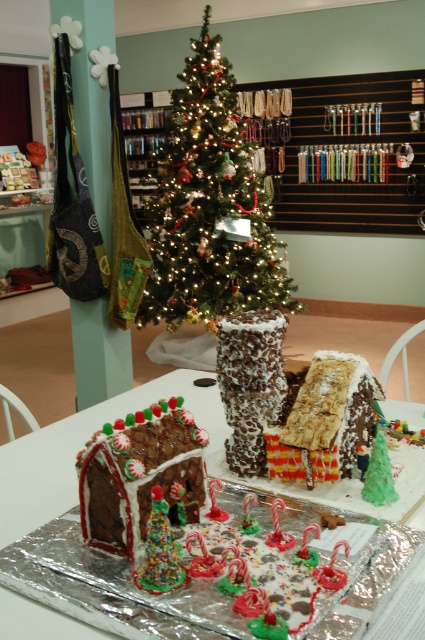
Does chocolate cake at center appear under chocolate-frosted gingerbread house at center?

Correct, chocolate cake at center is located below chocolate-frosted gingerbread house at center.

Does point (214, 451) come behind point (261, 365)?

Yes, point (214, 451) is farther from viewer.

Identify the location of chocolate cake at center. The image size is (425, 640). (81, 445).

Who is more forward, (x=198, y=65) or (x=121, y=508)?

Point (x=121, y=508)

Is point (200, 104) positioned in front of point (85, 506)?

That is False.

Where is `green matte christmas tree at center`? This screenshot has width=425, height=640. green matte christmas tree at center is located at coordinates (209, 205).

Is chocolate frosted gingerbread house at center to the left of chocolate-frosted gingerbread house at center from the viewer's perspective?

Correct, you'll find chocolate frosted gingerbread house at center to the left of chocolate-frosted gingerbread house at center.

Can you confirm if chocolate frosted gingerbread house at center is thinner than chocolate-frosted gingerbread house at center?

Yes.

Between point (189, 467) and point (303, 410), which one is positioned behind?

The point (303, 410) is behind.

Locate an element on the screen. The width and height of the screenshot is (425, 640). chocolate frosted gingerbread house at center is located at coordinates (138, 474).